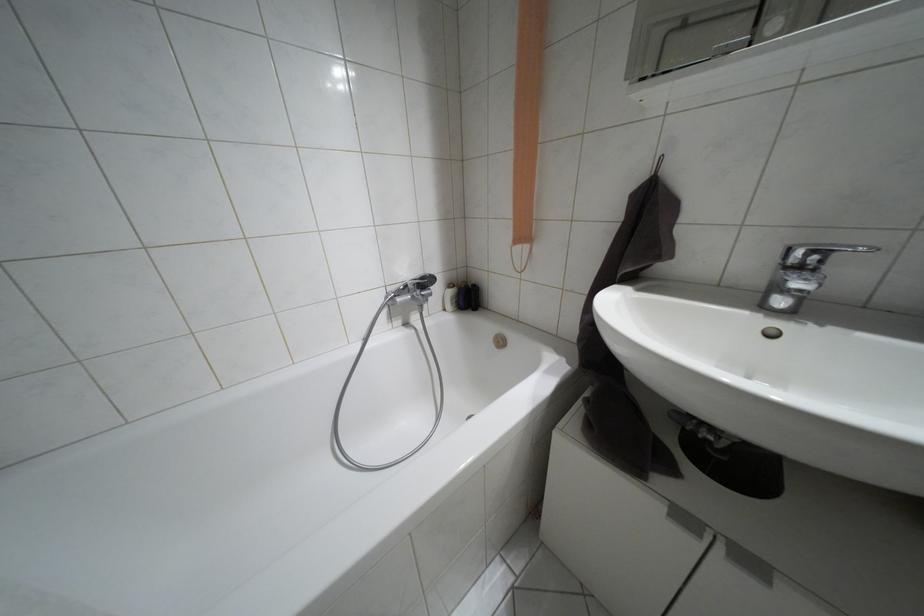
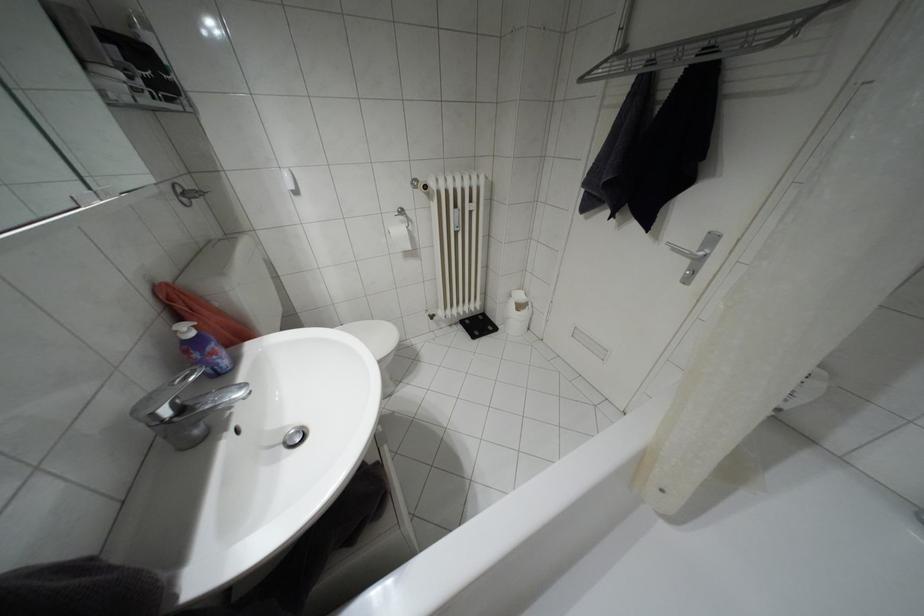
Where in the second image is the point corresponding to (797,269) from the first image?

(180, 408)